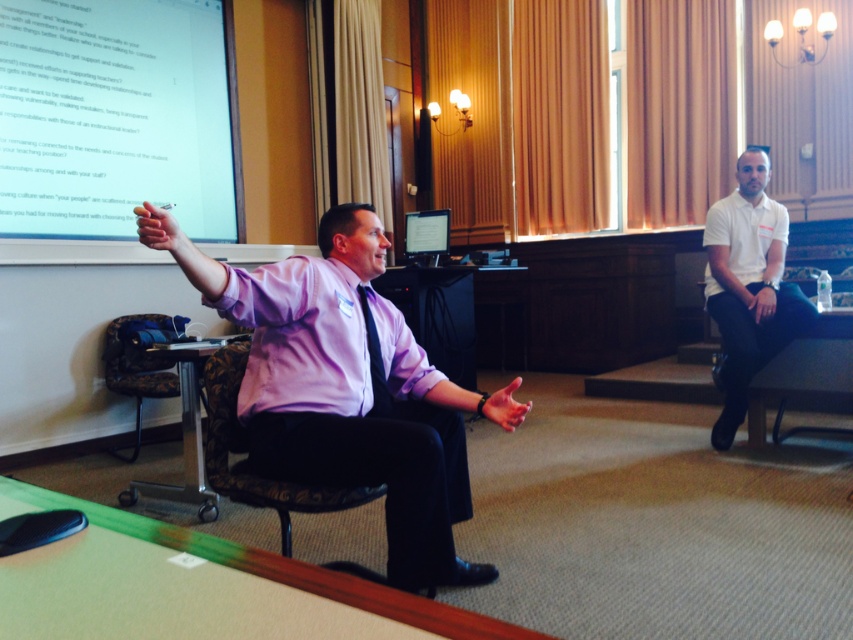
Is matte purple shirt at center to the right of white cotton polo shirt at right from the viewer's perspective?

Incorrect, matte purple shirt at center is not on the right side of white cotton polo shirt at right.

Does matte purple shirt at center come behind white cotton polo shirt at right?

No, it is not.

Does point (374, 307) lie in front of point (779, 340)?

Yes, point (374, 307) is closer to viewer.

Where is `matte purple shirt at center`? matte purple shirt at center is located at coordinates (347, 388).

Can you confirm if matte purple shirt at center is thinner than white paper at upper left?

Correct, matte purple shirt at center's width is less than white paper at upper left's.

Who is positioned more to the left, matte purple shirt at center or white paper at upper left?

white paper at upper left is more to the left.

Is point (399, 584) in front of point (218, 214)?

Yes, it is in front of point (218, 214).

Locate an element on the screen. The image size is (853, 640). matte purple shirt at center is located at coordinates (347, 388).

Who is lower down, velvet-patterned armchair at center or black satin tie at center?

velvet-patterned armchair at center is lower down.

This screenshot has width=853, height=640. I want to click on velvet-patterned armchair at center, so click(x=245, y=449).

Find the location of a particular element. Image resolution: width=853 pixels, height=640 pixels. velvet-patterned armchair at center is located at coordinates (245, 449).